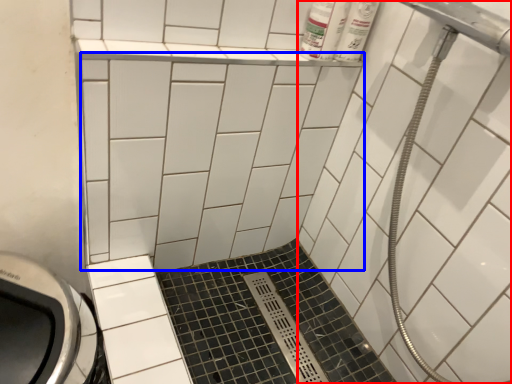
Question: Which point is closer to the camera, bath (highlighted by a red box) or ceramic tile (highlighted by a blue box)?

Choices:
 (A) bath
 (B) ceramic tile

Answer: (A)